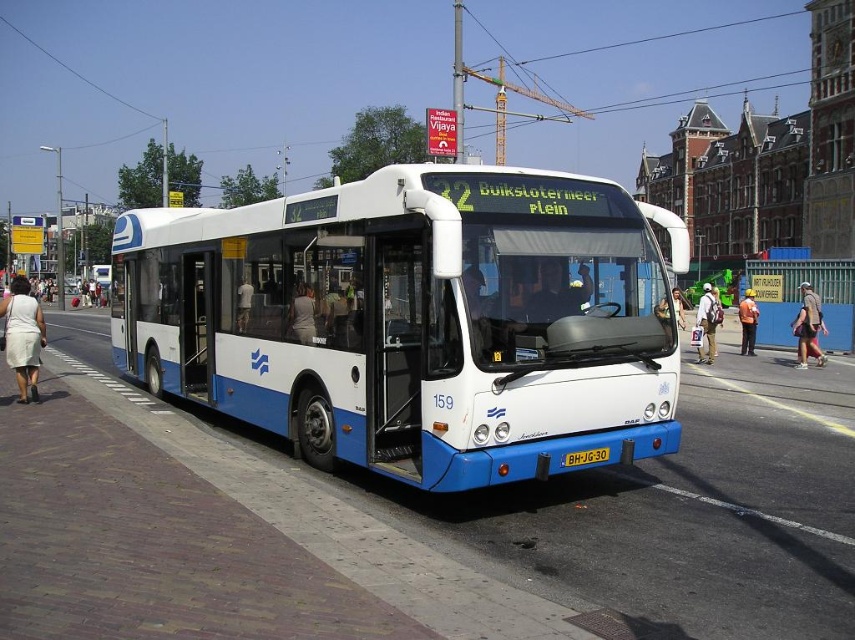
Question: Is light beige fabric dress at lower left bigger than denim jacket at lower right?

Choices:
 (A) no
 (B) yes

Answer: (B)

Question: Does light beige fabric dress at lower left have a greater width compared to denim jacket at lower right?

Choices:
 (A) no
 (B) yes

Answer: (B)

Question: Which point appears closest to the camera in this image?

Choices:
 (A) (818, 353)
 (B) (711, 330)
 (C) (771, 296)

Answer: (A)

Question: Is white matte bus at center wider than light gray fabric jacket at center?

Choices:
 (A) yes
 (B) no

Answer: (A)

Question: Which of the following is the farthest from the observer?

Choices:
 (A) (205, 524)
 (B) (705, 321)
 (C) (16, 305)
 (D) (304, 296)

Answer: (B)

Question: Among these points, which one is farthest from the camera?

Choices:
 (A) (237, 298)
 (B) (313, 252)

Answer: (A)